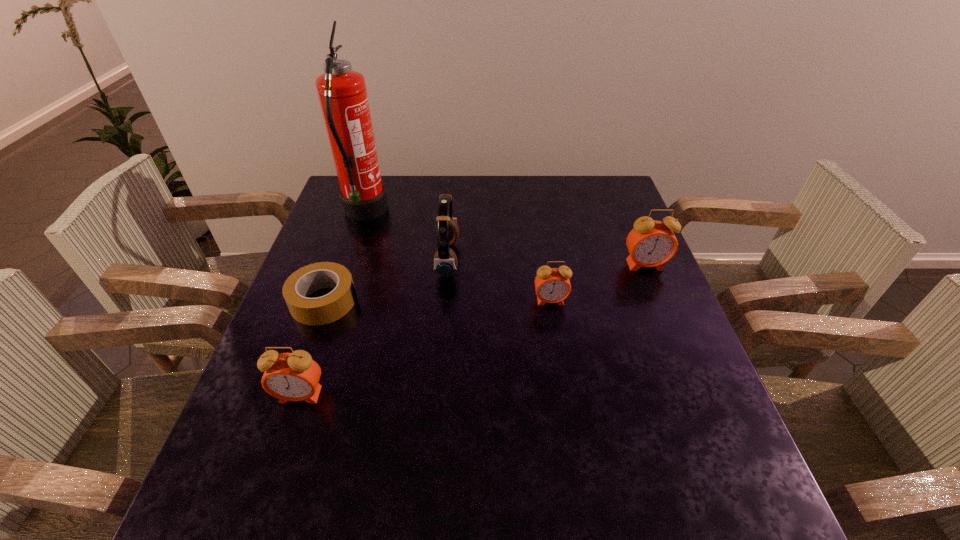
You are a GUI agent. You are given a task and a screenshot of the screen. Output one action in this format:
    pyautogui.click(x=<x>, y=<y>)
    Task: Click on the vacant space that's between the duct tape and the second alarm clock from left to right
    The width and height of the screenshot is (960, 540).
    Given the screenshot: What is the action you would take?
    pyautogui.click(x=438, y=301)

You are a GUI agent. You are given a task and a screenshot of the screen. Output one action in this format:
    pyautogui.click(x=<x>, y=<y>)
    Task: Click on the free space between the rightmost object and the duct tape
    The height and width of the screenshot is (540, 960).
    Given the screenshot: What is the action you would take?
    pyautogui.click(x=485, y=284)

Locate an element on the screen. Image resolution: width=960 pixels, height=540 pixels. free space that is in between the rightmost alarm clock and the tallest object is located at coordinates (505, 239).

I want to click on free space between the rightmost object and the headset, so click(546, 262).

Image resolution: width=960 pixels, height=540 pixels. In order to click on free space that is in between the farthest alarm clock and the shortest object in this screenshot , I will do `click(485, 284)`.

You are a GUI agent. You are given a task and a screenshot of the screen. Output one action in this format:
    pyautogui.click(x=<x>, y=<y>)
    Task: Click on the free point between the rightmost alarm clock and the shortest object
    This screenshot has height=540, width=960.
    Given the screenshot: What is the action you would take?
    pyautogui.click(x=485, y=284)

Where is `object that stands as the fifth closest to the fifth object from left to right`? Image resolution: width=960 pixels, height=540 pixels. object that stands as the fifth closest to the fifth object from left to right is located at coordinates click(294, 376).

Identify which object is the third closest to the second shortest object. Please provide its 2D coordinates. Your answer should be formatted as a tuple, i.e. [(x, y)], where the tuple contains the x and y coordinates of a point satisfying the conditions above.

[(326, 309)]

Locate an element on the screen. the closest alarm clock to the farthest object is located at coordinates (552, 285).

Where is `alarm clock that stands as the second closest to the farthest alarm clock`? alarm clock that stands as the second closest to the farthest alarm clock is located at coordinates (294, 376).